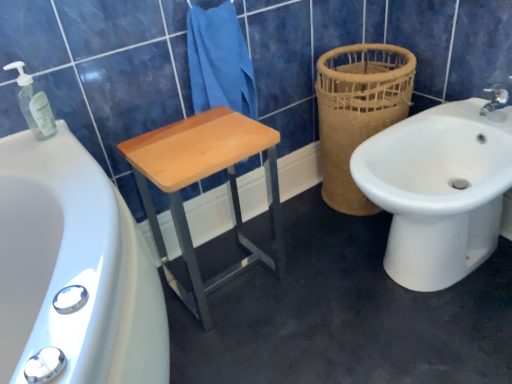
Find the location of a particular element. free space below light wood/matte stool at center (from a real-world perspective) is located at coordinates (231, 280).